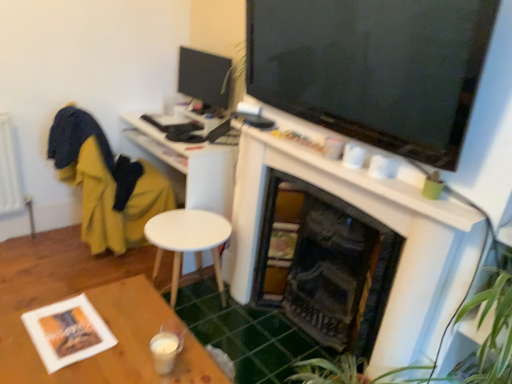
Question: From the image's perspective, does wooden table at lower left appear higher than yellow fabric swivel chair at left?

Choices:
 (A) no
 (B) yes

Answer: (A)

Question: Is wooden table at lower left positioned before yellow fabric swivel chair at left?

Choices:
 (A) yes
 (B) no

Answer: (A)

Question: Is wooden table at lower left positioned with its back to yellow fabric swivel chair at left?

Choices:
 (A) yes
 (B) no

Answer: (A)

Question: Is wooden table at lower left directly adjacent to yellow fabric swivel chair at left?

Choices:
 (A) yes
 (B) no

Answer: (B)

Question: Can we say wooden table at lower left lies outside yellow fabric swivel chair at left?

Choices:
 (A) yes
 (B) no

Answer: (A)

Question: Is point (64, 367) positioned closer to the camera than point (181, 218)?

Choices:
 (A) farther
 (B) closer

Answer: (B)

Question: Is wooden table at lower left to the left or to the right of white matte round table at center in the image?

Choices:
 (A) left
 (B) right

Answer: (A)

Question: Is wooden table at lower left taller or shorter than white matte round table at center?

Choices:
 (A) tall
 (B) short

Answer: (A)

Question: Is wooden table at lower left inside or outside of white matte round table at center?

Choices:
 (A) inside
 (B) outside

Answer: (B)

Question: Considering their positions, is green leafy plant at lower right located in front of or behind white matte round table at center?

Choices:
 (A) front
 (B) behind

Answer: (A)

Question: From a real-world perspective, is green leafy plant at lower right physically located above or below white matte round table at center?

Choices:
 (A) above
 (B) below

Answer: (A)

Question: Is green leafy plant at lower right spatially inside white matte round table at center, or outside of it?

Choices:
 (A) outside
 (B) inside

Answer: (A)

Question: From the image's perspective, is green leafy plant at lower right positioned above or below white matte round table at center?

Choices:
 (A) above
 (B) below

Answer: (B)

Question: Considering the positions of green leafy plant at lower right and white matte desk at center in the image, is green leafy plant at lower right taller or shorter than white matte desk at center?

Choices:
 (A) short
 (B) tall

Answer: (A)

Question: Looking at the image, does green leafy plant at lower right seem bigger or smaller compared to white matte desk at center?

Choices:
 (A) small
 (B) big

Answer: (A)